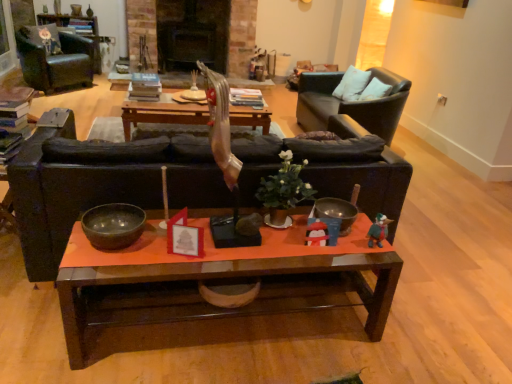
You are a GUI agent. You are given a task and a screenshot of the screen. Output one action in this format:
    pyautogui.click(x=<x>, y=<y>)
    Task: Click on the free space to the right of matte black couch at center
    Image resolution: width=512 pixels, height=384 pixels.
    Given the screenshot: What is the action you would take?
    pyautogui.click(x=445, y=269)